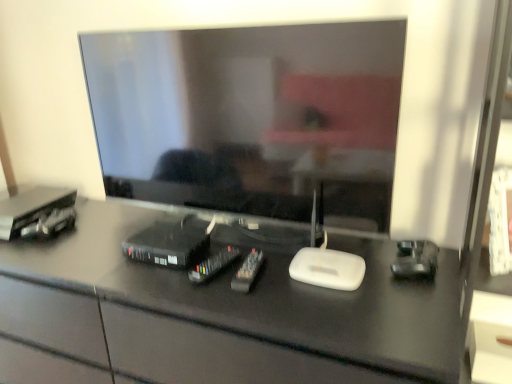
Identify the location of empty space that is in between black plastic dvd player at lower left, which is the third equipment in right-to-left order, and black plastic remote control at center, the second equipment viewed from the right. Image resolution: width=512 pixels, height=384 pixels. (184, 264).